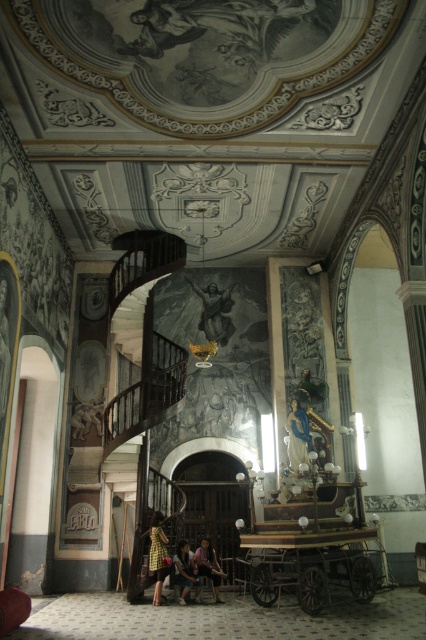
Question: Which of these objects is positioned closest to the wooden wagon at center?

Choices:
 (A) light brown fabric skirt at lower center
 (B) dark brown leather chair at center
 (C) checkered fabric dress at center
 (D) blue fabric statue at center

Answer: (B)

Question: Where is wooden wagon at center located in relation to light brown fabric skirt at lower center in the image?

Choices:
 (A) below
 (B) above

Answer: (B)

Question: Which point is farther from the camera taking this photo?

Choices:
 (A) (307, 458)
 (B) (357, 573)
 (C) (161, 550)

Answer: (A)

Question: Can you confirm if checkered fabric dress at center is wider than light brown fabric skirt at lower center?

Choices:
 (A) no
 (B) yes

Answer: (A)

Question: Which point appears farthest from the camera in this image?

Choices:
 (A) (301, 449)
 (B) (158, 592)

Answer: (A)

Question: Can you confirm if wooden wagon at center is positioned above blue fabric statue at center?

Choices:
 (A) yes
 (B) no

Answer: (B)